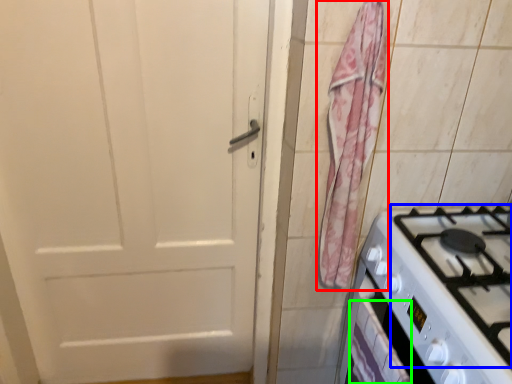
Question: Estimate the real-world distances between objects in this image. Which object is farther from curtain (highlighted by a red box), gas stove (highlighted by a blue box) or drawer (highlighted by a green box)?

Choices:
 (A) gas stove
 (B) drawer

Answer: (B)